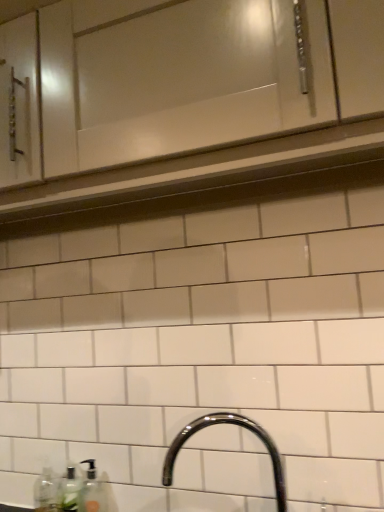
Question: From the image's perspective, is translucent plastic soap dispenser at lower left below clear plastic bottle at lower left, the 2th bottle positioned from the right?

Choices:
 (A) no
 (B) yes

Answer: (A)

Question: Is translucent plastic soap dispenser at lower left bigger than clear plastic bottle at lower left, which appears as the first bottle when viewed from the left?

Choices:
 (A) no
 (B) yes

Answer: (A)

Question: Is the position of translucent plastic soap dispenser at lower left more distant than that of clear plastic bottle at lower left, the 2th bottle positioned from the right?

Choices:
 (A) yes
 (B) no

Answer: (B)

Question: From the image's perspective, is translucent plastic soap dispenser at lower left above clear plastic bottle at lower left, the 2th bottle positioned from the right?

Choices:
 (A) no
 (B) yes

Answer: (B)

Question: Is translucent plastic soap dispenser at lower left outside clear plastic bottle at lower left, which appears as the first bottle when viewed from the left?

Choices:
 (A) yes
 (B) no

Answer: (A)

Question: Is glossy chrome faucet at lower center inside the boundaries of clear glass soap dispenser at lower left, the second bottle viewed from the left, or outside?

Choices:
 (A) inside
 (B) outside

Answer: (B)

Question: In terms of height, does glossy chrome faucet at lower center look taller or shorter compared to clear glass soap dispenser at lower left, the first bottle in the right-to-left sequence?

Choices:
 (A) tall
 (B) short

Answer: (A)

Question: Is glossy chrome faucet at lower center wider or thinner than clear glass soap dispenser at lower left, the first bottle in the right-to-left sequence?

Choices:
 (A) wide
 (B) thin

Answer: (A)

Question: From a real-world perspective, is glossy chrome faucet at lower center physically located above or below clear glass soap dispenser at lower left, the second bottle viewed from the left?

Choices:
 (A) above
 (B) below

Answer: (A)

Question: In the image, is translucent plastic soap dispenser at lower left positioned in front of or behind clear glass soap dispenser at lower left, the second bottle viewed from the left?

Choices:
 (A) behind
 (B) front

Answer: (B)

Question: In terms of height, does translucent plastic soap dispenser at lower left look taller or shorter compared to clear glass soap dispenser at lower left, the second bottle viewed from the left?

Choices:
 (A) short
 (B) tall

Answer: (A)

Question: Is translucent plastic soap dispenser at lower left wider or thinner than clear glass soap dispenser at lower left, the first bottle in the right-to-left sequence?

Choices:
 (A) thin
 (B) wide

Answer: (A)

Question: From the image's perspective, relative to clear glass soap dispenser at lower left, the second bottle viewed from the left, is translucent plastic soap dispenser at lower left above or below?

Choices:
 (A) above
 (B) below

Answer: (A)

Question: From a real-world perspective, is translucent plastic soap dispenser at lower left above or below clear plastic bottle at lower left, which appears as the first bottle when viewed from the left?

Choices:
 (A) below
 (B) above

Answer: (B)

Question: Based on their sizes in the image, would you say translucent plastic soap dispenser at lower left is bigger or smaller than clear plastic bottle at lower left, the 2th bottle positioned from the right?

Choices:
 (A) small
 (B) big

Answer: (A)